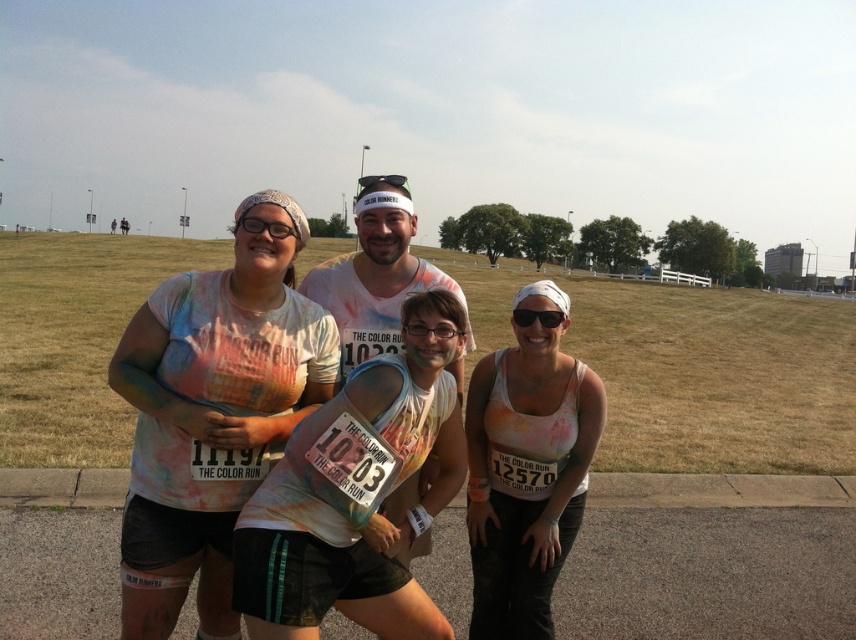
Who is higher up, multicolored tie-dye shirt at center or painted cotton shirt at center?

painted cotton shirt at center is above.

Between point (401, 380) and point (355, 198), which one is positioned in front?

Point (401, 380)

Between point (385, 404) and point (339, 259), which one is positioned behind?

The point (339, 259) is behind.

Locate an element on the screen. Image resolution: width=856 pixels, height=640 pixels. multicolored tie-dye shirt at center is located at coordinates (372, 513).

Does matte white tank top at center have a greater height compared to black matte goggles at center?

No, matte white tank top at center is not taller than black matte goggles at center.

Between point (556, 568) and point (403, 179), which one is positioned behind?

Positioned behind is point (403, 179).

This screenshot has width=856, height=640. Identify the location of matte white tank top at center. (526, 468).

Which is behind, point (175, 550) or point (358, 188)?

The point (358, 188) is more distant.

Is point (331, 362) positioned before point (399, 173)?

Yes.

Between point (265, 419) and point (399, 179), which one is positioned behind?

The point (399, 179) is behind.

The image size is (856, 640). In order to click on multicolored fabric shirt at center in this screenshot , I will do `click(214, 412)`.